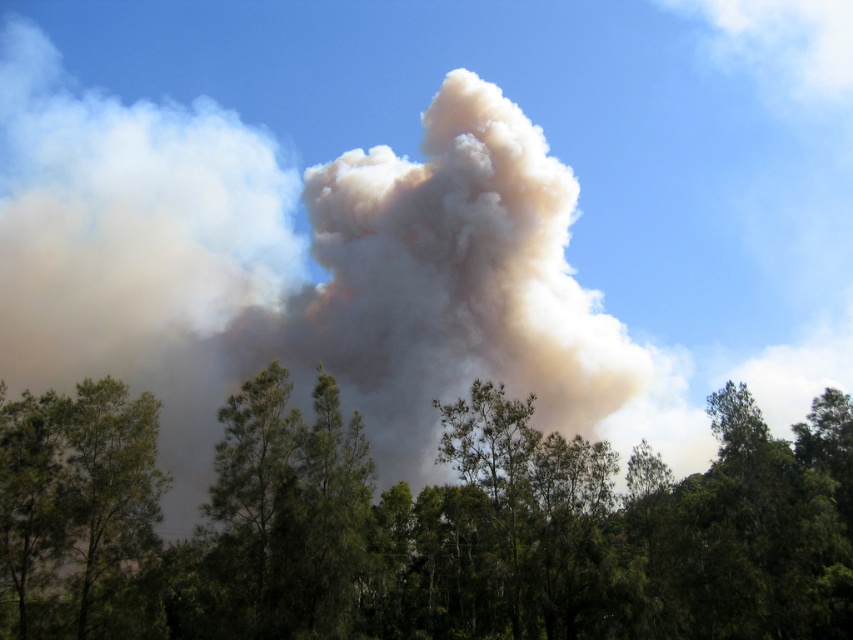
Who is lower down, green leafy trees at lower center or green leafy tree at lower left?

green leafy trees at lower center is below.

Does green leafy trees at lower center have a greater width compared to green leafy tree at lower left?

Yes, green leafy trees at lower center is wider than green leafy tree at lower left.

Between point (820, 573) and point (142, 609), which one is positioned behind?

Point (820, 573)

I want to click on green leafy trees at lower center, so click(419, 525).